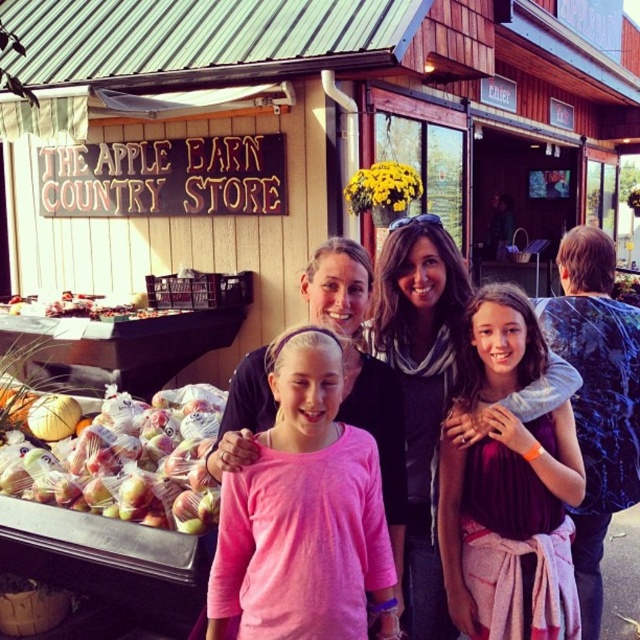
Does pink cotton shirt at center come behind shiny plastic apples at lower left?

No.

Is point (230, 580) less distant than point (22, 310)?

Yes, point (230, 580) is closer to viewer.

Where is `pink cotton shirt at center`? pink cotton shirt at center is located at coordinates (305, 508).

Between black scarf at center and translucent plastic bags of apples at lower left, which one has less height?

translucent plastic bags of apples at lower left is shorter.

Between black scarf at center and translucent plastic bags of apples at lower left, which one appears on the left side from the viewer's perspective?

From the viewer's perspective, translucent plastic bags of apples at lower left appears more on the left side.

Between point (442, 636) and point (12, 433), which one is positioned behind?

Point (12, 433)

What are the coordinates of `black scarf at center` in the screenshot? It's located at (420, 388).

Does translucent plastic bags of apples at lower left have a lesser width compared to shiny plastic apples at lower left?

Indeed, translucent plastic bags of apples at lower left has a lesser width compared to shiny plastic apples at lower left.

Which of these two, translucent plastic bags of apples at lower left or shiny plastic apples at lower left, stands shorter?

shiny plastic apples at lower left

Between point (141, 417) and point (26, 304), which one is positioned in front?

Point (141, 417)

The height and width of the screenshot is (640, 640). In order to click on translucent plastic bags of apples at lower left in this screenshot , I will do `click(125, 460)`.